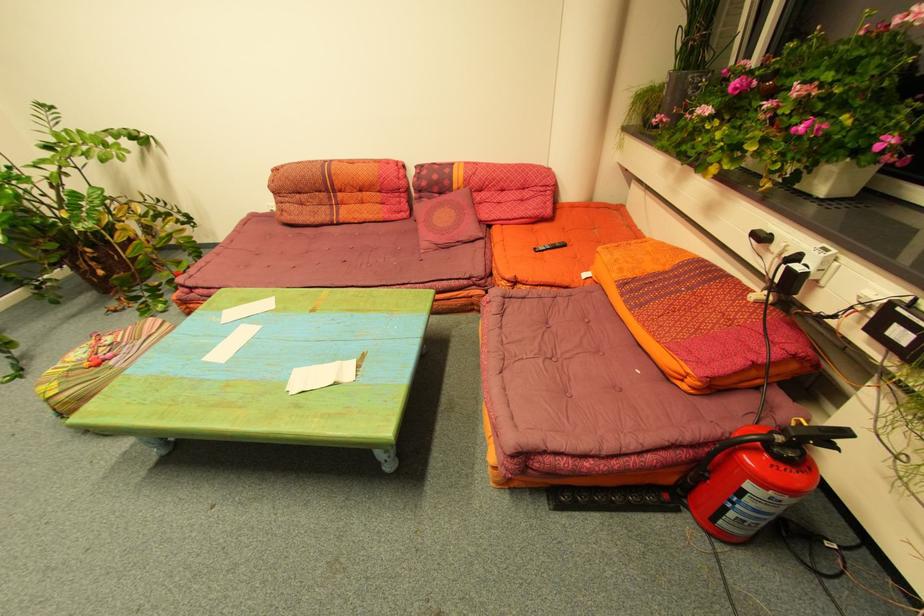
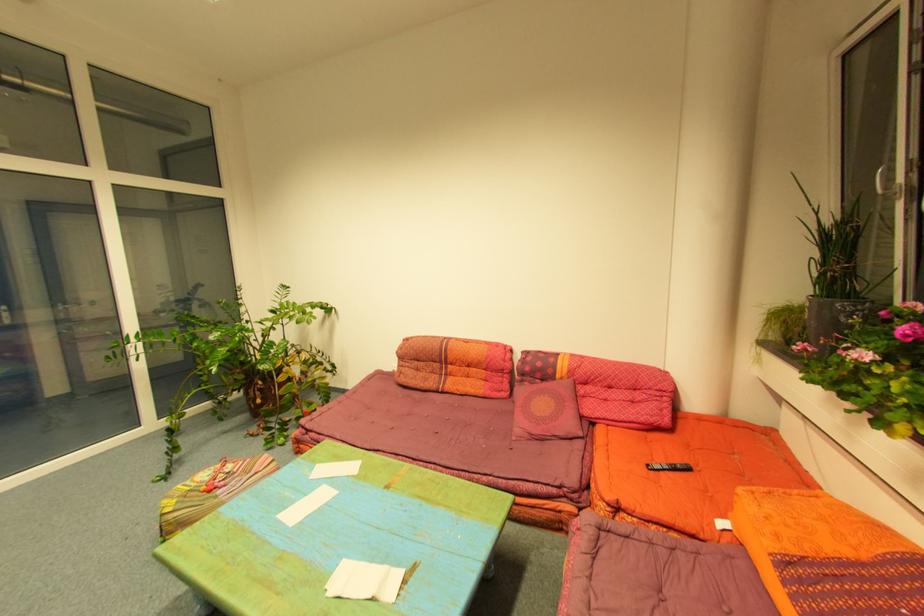
The first image is from the beginning of the video and the second image is from the end. How did the camera likely rotate when shooting the video?

The rotation direction of the camera is left-up.